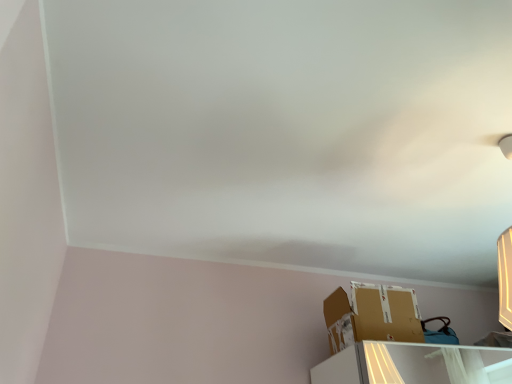
Question: Should I look upward or downward to see brown cardboard box at lower right?

Choices:
 (A) down
 (B) up

Answer: (A)